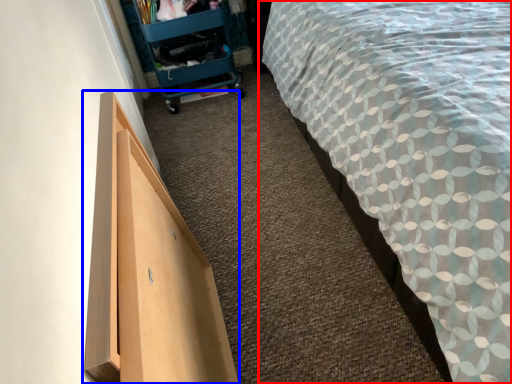
Question: Which object is closer to the camera taking this photo, bed (highlighted by a red box) or furniture (highlighted by a blue box)?

Choices:
 (A) bed
 (B) furniture

Answer: (A)